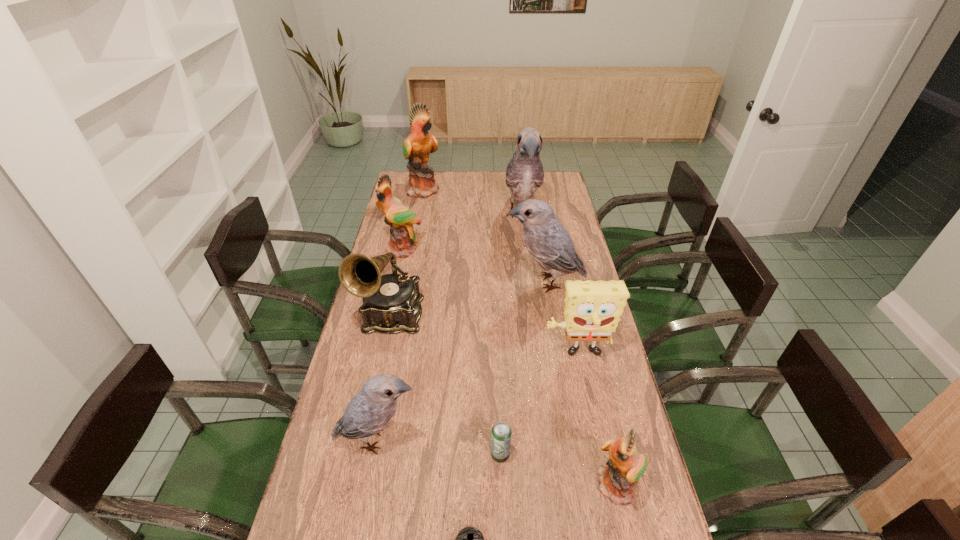
Locate which parrot is the sixth closest to the yellow sponge. Please provide its 2D coordinates. Your answer should be formatted as a tuple, i.e. [(x, y)], where the tuple contains the x and y coordinates of a point satisfying the conditions above.

[(417, 147)]

Where is `green parrot that is the closest to the sponge`? This screenshot has width=960, height=540. green parrot that is the closest to the sponge is located at coordinates (626, 465).

This screenshot has width=960, height=540. I want to click on green parrot that is the second nearest to the second biggest green parrot, so click(x=626, y=465).

This screenshot has height=540, width=960. Find the location of `gray parrot that is the second closest to the control`. gray parrot that is the second closest to the control is located at coordinates (549, 244).

Choose which gray parrot is the nearest neighbor to the farthest gray parrot. Please provide its 2D coordinates. Your answer should be formatted as a tuple, i.e. [(x, y)], where the tuple contains the x and y coordinates of a point satisfying the conditions above.

[(549, 244)]

Locate an element on the screen. vacant space that satisfies the following two spatial constraints: 1. on the front-facing side of the biggest green parrot; 2. on the left side of the fifth object from right to left is located at coordinates (374, 455).

The image size is (960, 540). What are the coordinates of `vacant space that satisfies the following two spatial constraints: 1. on the front-facing side of the second smallest gray parrot; 2. on the front side of the beer can` in the screenshot? It's located at (574, 455).

I want to click on vacant point that satisfies the following two spatial constraints: 1. on the front-facing side of the biggest green parrot; 2. on the horn of the phonograph record, so click(400, 315).

Locate an element on the screen. The image size is (960, 540). vacant space that satisfies the following two spatial constraints: 1. on the front-facing side of the beer can; 2. on the right side of the smallest gray parrot is located at coordinates (374, 455).